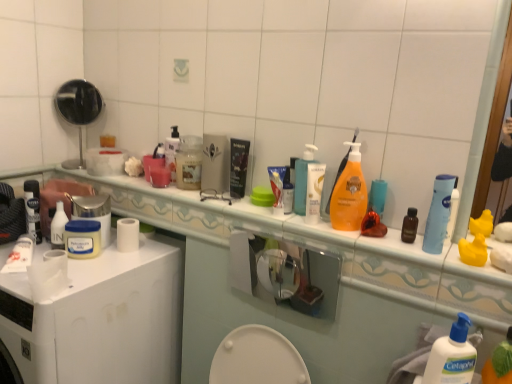
This screenshot has width=512, height=384. Find the location of `free location to the right of white matte jar at center-left, the first toiletry positioned from the back`. free location to the right of white matte jar at center-left, the first toiletry positioned from the back is located at coordinates (120, 260).